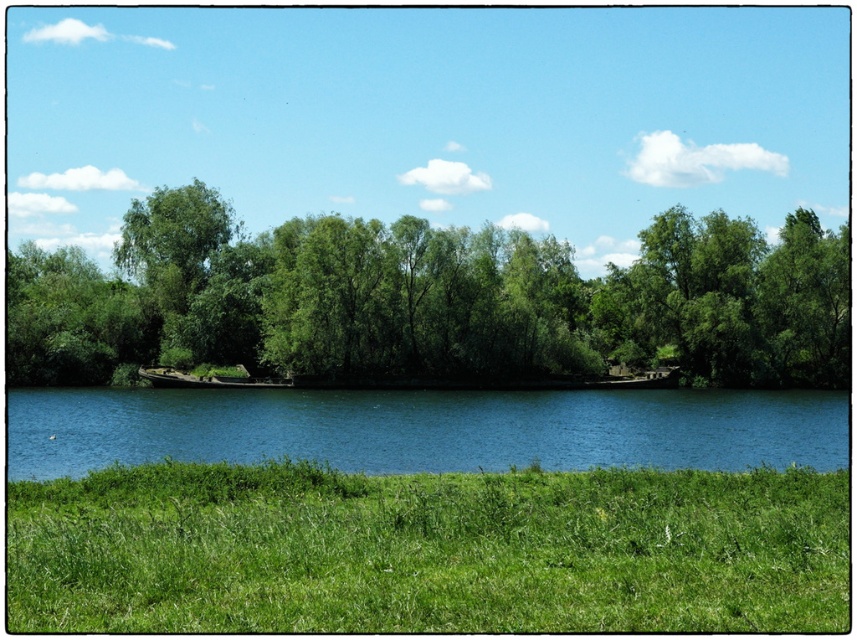
Question: Considering the real-world distances, which object is closest to the blue water at center?

Choices:
 (A) green leafy trees at center
 (B) green grassy field at lower center

Answer: (A)

Question: Which is farther from the blue water at center?

Choices:
 (A) green grassy field at lower center
 (B) green leafy trees at center

Answer: (A)

Question: Can you confirm if green grassy field at lower center is positioned above green leafy trees at center?

Choices:
 (A) yes
 (B) no

Answer: (B)

Question: Considering the relative positions of green leafy trees at center and blue water at center in the image provided, where is green leafy trees at center located with respect to blue water at center?

Choices:
 (A) below
 (B) above

Answer: (B)

Question: Is green grassy field at lower center closer to the viewer compared to green leafy trees at center?

Choices:
 (A) no
 (B) yes

Answer: (B)

Question: Estimate the real-world distances between objects in this image. Which object is closer to the blue water at center?

Choices:
 (A) green leafy trees at center
 (B) green grassy field at lower center

Answer: (A)